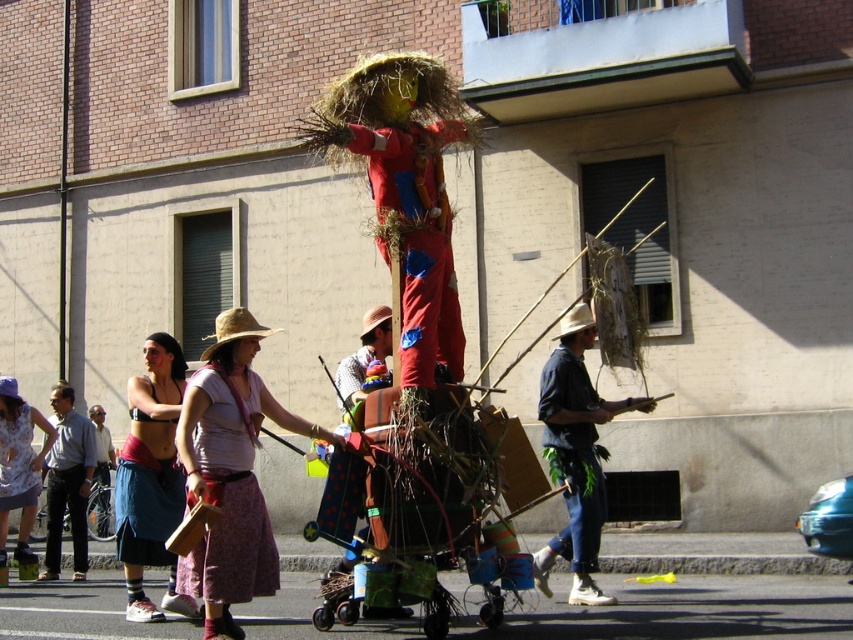
Who is lower down, matte gray shirt at center or printed cotton dress at lower left?

printed cotton dress at lower left is below.

Which is in front, point (86, 563) or point (15, 424)?

Point (15, 424) is more forward.

Measure the distance between point (79,506) and camera.

Point (79,506) is 44.27 feet away from camera.

Where is `matte gray shirt at center`? This screenshot has height=640, width=853. matte gray shirt at center is located at coordinates (67, 481).

Does point (271, 580) come in front of point (126, 616)?

That is True.

In the scene shown: Who is positioned more to the right, matte pink fabric dress at center or matte black tank top at center?

matte pink fabric dress at center

What do you see at coordinates (230, 472) in the screenshot? This screenshot has height=640, width=853. I see `matte pink fabric dress at center` at bounding box center [230, 472].

This screenshot has width=853, height=640. What are the coordinates of `matte pink fabric dress at center` in the screenshot? It's located at (230, 472).

Which is in front, point (154, 412) or point (109, 524)?

Point (154, 412) is more forward.

Consider the image. Measure the distance from matte black tank top at center to light brown wooden cane at center.

matte black tank top at center is 7.43 meters away from light brown wooden cane at center.

Which is in front, point (135, 608) or point (94, 504)?

Point (135, 608)

At what (x,y) coordinates should I click in order to perform the action: click on matte black tank top at center. Please return your answer as a coordinate pair (x, y). Looking at the image, I should click on (151, 477).